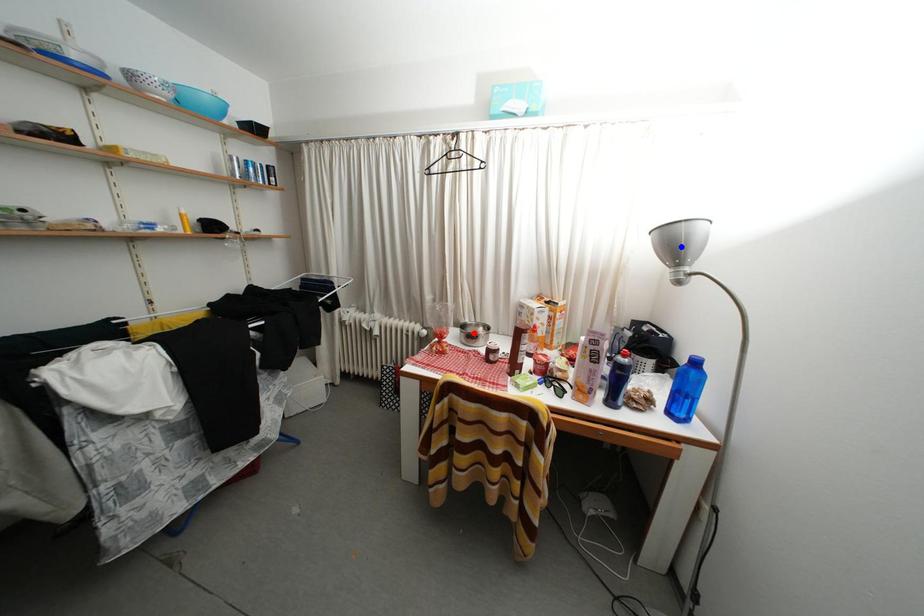
Question: Two points are marked on the image. Which point is closer to the camera?

Choices:
 (A) Blue point is closer.
 (B) Red point is closer.

Answer: (A)